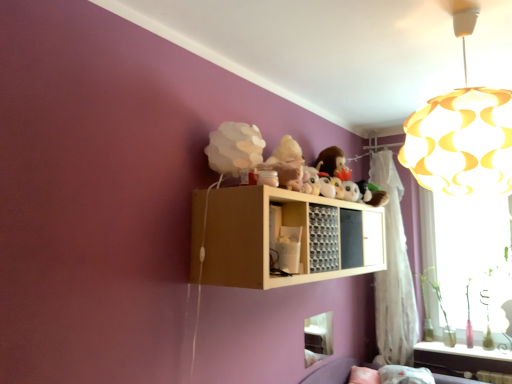
Question: Does transparent glass window at right, the 1th window screen viewed from the back, have a larger size compared to light wood shelf at upper center?

Choices:
 (A) yes
 (B) no

Answer: (B)

Question: Can you confirm if transparent glass window at right, placed as the 1th window screen when sorted from right to left, is wider than light wood shelf at upper center?

Choices:
 (A) yes
 (B) no

Answer: (B)

Question: Does transparent glass window at right, which is counted as the 2th window screen, starting from the front, lie in front of light wood shelf at upper center?

Choices:
 (A) no
 (B) yes

Answer: (A)

Question: Is transparent glass window at right, the 1th window screen viewed from the back, with light wood shelf at upper center?

Choices:
 (A) no
 (B) yes

Answer: (A)

Question: From a real-world perspective, does transparent glass window at right, which is counted as the 2th window screen, starting from the front, sit lower than light wood shelf at upper center?

Choices:
 (A) no
 (B) yes

Answer: (B)

Question: Is point (326, 269) positioned closer to the camera than point (330, 337)?

Choices:
 (A) closer
 (B) farther

Answer: (A)

Question: Looking at the image, does wooden grid at upper center seem bigger or smaller compared to transparent plastic window screen at lower center, the second window screen from the back?

Choices:
 (A) small
 (B) big

Answer: (B)

Question: In terms of width, does wooden grid at upper center look wider or thinner when compared to transparent plastic window screen at lower center, positioned as the first window screen in front-to-back order?

Choices:
 (A) wide
 (B) thin

Answer: (A)

Question: Relative to transparent plastic window screen at lower center, which appears as the 2th window screen when viewed from the right, is wooden grid at upper center in front or behind?

Choices:
 (A) behind
 (B) front

Answer: (B)

Question: From their relative heights in the image, would you say transparent plastic window screen at lower center, which appears as the 2th window screen when viewed from the right, is taller or shorter than translucent glass bottles at lower right?

Choices:
 (A) short
 (B) tall

Answer: (B)

Question: From the image's perspective, is transparent plastic window screen at lower center, which appears as the 2th window screen when viewed from the right, located above or below translucent glass bottles at lower right?

Choices:
 (A) above
 (B) below

Answer: (A)

Question: Based on their sizes in the image, would you say transparent plastic window screen at lower center, which appears as the 2th window screen when viewed from the right, is bigger or smaller than translucent glass bottles at lower right?

Choices:
 (A) big
 (B) small

Answer: (B)

Question: Relative to translucent glass bottles at lower right, is transparent plastic window screen at lower center, which appears as the 1th window screen when viewed from the left, in front or behind?

Choices:
 (A) behind
 (B) front

Answer: (B)

Question: Is fuzzy fabric plush at upper center bigger or smaller than yellow paper lampshade at upper right?

Choices:
 (A) big
 (B) small

Answer: (B)

Question: Relative to yellow paper lampshade at upper right, is fuzzy fabric plush at upper center in front or behind?

Choices:
 (A) behind
 (B) front

Answer: (A)